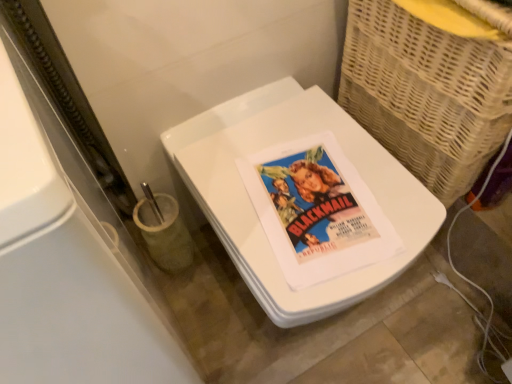
Measure the distance between point [407,56] and camera.

Point [407,56] is 32.28 inches away from camera.

You are a GUI agent. You are given a task and a screenshot of the screen. Output one action in this format:
    pyautogui.click(x=<x>, y=<y>)
    Task: Click on the woven wicker basket at right
    The image size is (512, 384).
    Given the screenshot: What is the action you would take?
    [x=426, y=94]

Relative to matte paper poster at center, is white glossy toilet at center in front or behind?

white glossy toilet at center is in front of matte paper poster at center.

Could you tell me if white glossy toilet at center is turned towards matte paper poster at center?

No, white glossy toilet at center does not turn towards matte paper poster at center.

Considering the sizes of objects white glossy toilet at center and matte paper poster at center in the image provided, who is bigger, white glossy toilet at center or matte paper poster at center?

With larger size is white glossy toilet at center.

From a real-world perspective, who is located higher, matte paper poster at center or woven wicker basket at right?

woven wicker basket at right is physically above.

Is woven wicker basket at right a part of matte paper poster at center?

No, woven wicker basket at right is located outside of matte paper poster at center.

Does matte paper poster at center have a greater height compared to woven wicker basket at right?

No, matte paper poster at center is not taller than woven wicker basket at right.

Locate an element on the screen. This screenshot has height=384, width=512. comic book character behind the woven wicker basket at right is located at coordinates (314, 203).

Which is behind, woven wicker basket at right or white glossy toilet at center?

white glossy toilet at center.

From the picture: From the image's perspective, does woven wicker basket at right appear lower than white glossy toilet at center?

Incorrect, from the image's perspective, woven wicker basket at right is higher than white glossy toilet at center.

Is woven wicker basket at right wider than white glossy toilet at center?

No, woven wicker basket at right is not wider than white glossy toilet at center.

Is woven wicker basket at right directly adjacent to white glossy toilet at center?

No, woven wicker basket at right is not making contact with white glossy toilet at center.

Does matte paper poster at center have a lesser height compared to white glossy toilet at center?

Yes, matte paper poster at center is shorter than white glossy toilet at center.

Which is behind, point (293, 241) or point (392, 169)?

The point (392, 169) is behind.

The height and width of the screenshot is (384, 512). Identify the location of toilet on the left side of matte paper poster at center. (255, 212).

Is matte paper poster at center aimed at white glossy toilet at center?

Yes, matte paper poster at center is turned towards white glossy toilet at center.

Is white glossy toilet at center beside woven wicker basket at right?

No, white glossy toilet at center is not in contact with woven wicker basket at right.

From the image's perspective, which object appears higher, white glossy toilet at center or woven wicker basket at right?

woven wicker basket at right appears higher in the image.

In the image, is white glossy toilet at center positioned in front of or behind woven wicker basket at right?

Clearly, white glossy toilet at center is behind woven wicker basket at right.

How much distance is there between white glossy toilet at center and woven wicker basket at right?

They are 8.34 inches apart.

From the picture: From the image's perspective, does woven wicker basket at right appear higher than matte paper poster at center?

Indeed, from the image's perspective, woven wicker basket at right is shown above matte paper poster at center.

Do you think woven wicker basket at right is within matte paper poster at center, or outside of it?

woven wicker basket at right cannot be found inside matte paper poster at center.

Considering the sizes of objects woven wicker basket at right and matte paper poster at center in the image provided, who is taller, woven wicker basket at right or matte paper poster at center?

Standing taller between the two is woven wicker basket at right.

How different are the orientations of woven wicker basket at right and matte paper poster at center in degrees?

80.7 degrees.

This screenshot has width=512, height=384. I want to click on comic book character that is on the right side of white glossy toilet at center, so click(314, 203).

The image size is (512, 384). I want to click on basket positioned vertically above the matte paper poster at center (from a real-world perspective), so click(426, 94).

Which object lies further to the anchor point white glossy toilet at center, matte paper poster at center or woven wicker basket at right?

woven wicker basket at right is positioned further to the anchor white glossy toilet at center.

Which object lies further to the anchor point white glossy toilet at center, woven wicker basket at right or matte paper poster at center?

woven wicker basket at right is further to white glossy toilet at center.

Looking at this image, considering their positions, is woven wicker basket at right positioned further to matte paper poster at center than white glossy toilet at center?

The object further to matte paper poster at center is woven wicker basket at right.

Considering their positions, is matte paper poster at center positioned closer to woven wicker basket at right than white glossy toilet at center?

white glossy toilet at center is closer to woven wicker basket at right.

Considering their positions, is white glossy toilet at center positioned further to woven wicker basket at right than matte paper poster at center?

matte paper poster at center is further to woven wicker basket at right.

Estimate the real-world distances between objects in this image. Which object is closer to matte paper poster at center, white glossy toilet at center or woven wicker basket at right?

Among the two, white glossy toilet at center is located nearer to matte paper poster at center.

You are a GUI agent. You are given a task and a screenshot of the screen. Output one action in this format:
    pyautogui.click(x=<x>, y=<y>)
    Task: Click on the comic book character situated between white glossy toilet at center and woven wicker basket at right from left to right
    The height and width of the screenshot is (384, 512).
    Given the screenshot: What is the action you would take?
    pyautogui.click(x=314, y=203)